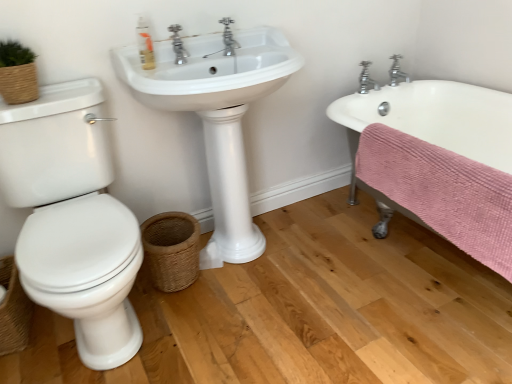
Image resolution: width=512 pixels, height=384 pixels. What are the coordinates of `vacant location below white glossy sink at center (from a real-world perspective)` in the screenshot? It's located at (260, 254).